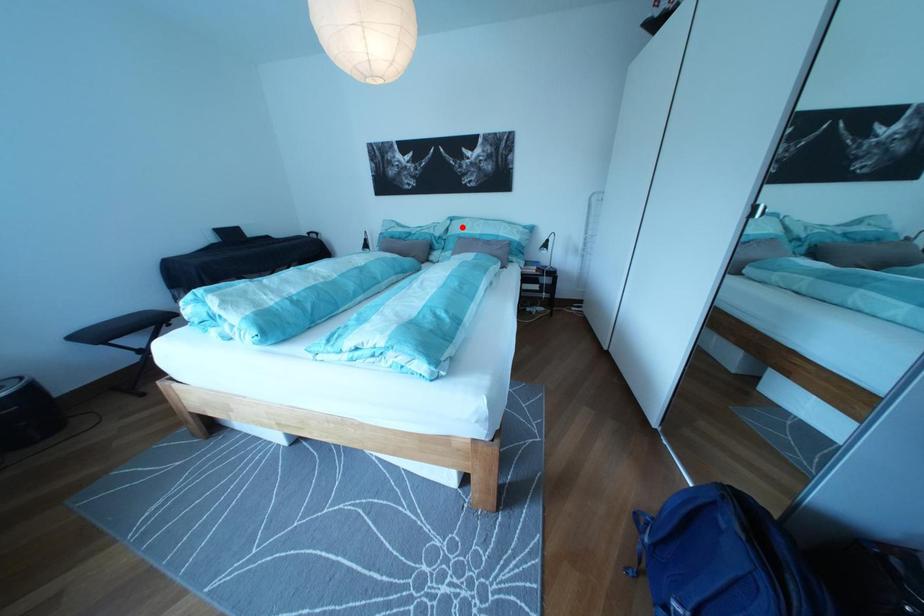
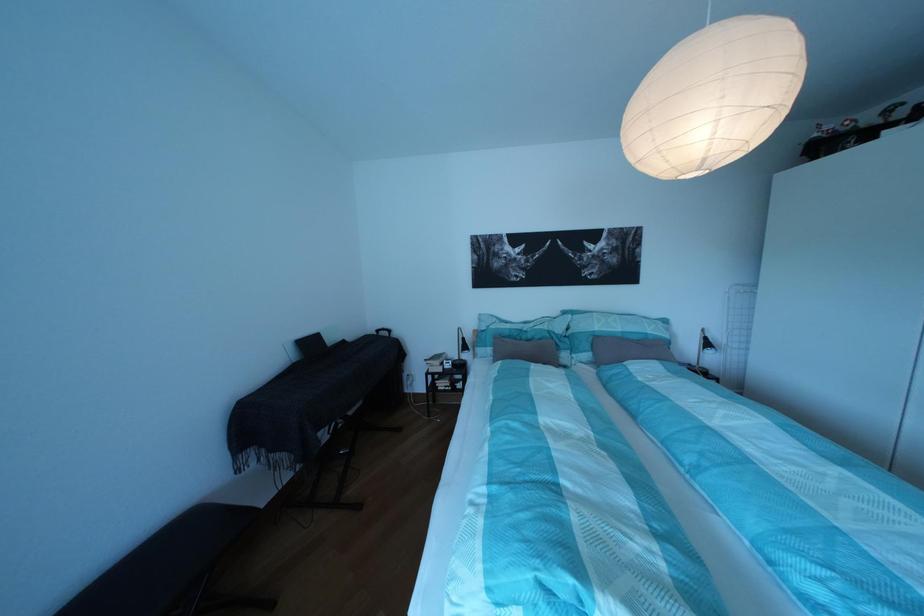
Question: I am providing you with two images of the same scene from different viewpoints. A red point is shown in image1. For the corresponding object point in image2, is it positioned nearer or farther from the camera?

Choices:
 (A) Nearer
 (B) Farther

Answer: (B)